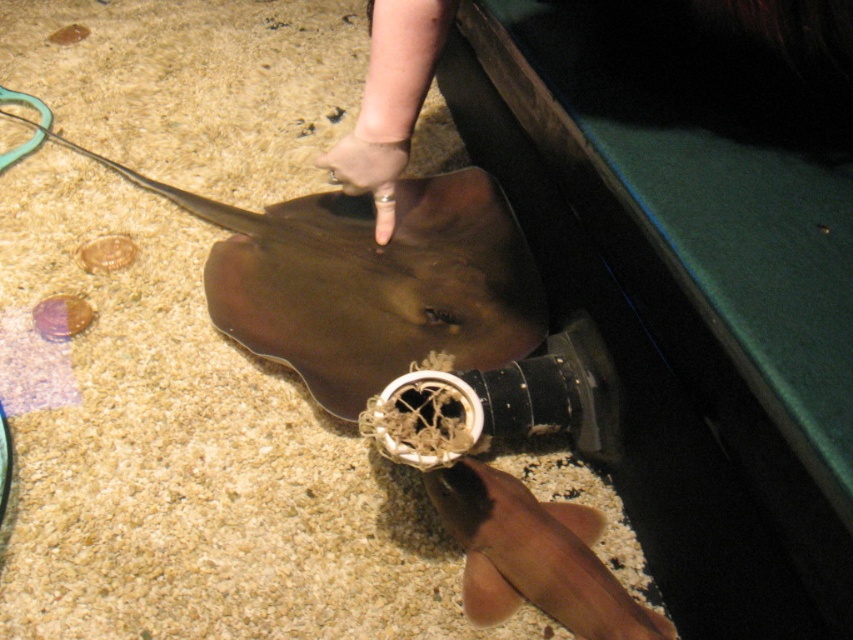
Question: Is brown matte stingray at center wider than smooth brown shark at lower center?

Choices:
 (A) yes
 (B) no

Answer: (A)

Question: Which object is closer to the camera taking this photo?

Choices:
 (A) smooth brown shark at lower center
 (B) brown matte stingray at center

Answer: (A)

Question: Among these points, which one is nearest to the camera?

Choices:
 (A) (469, 330)
 (B) (572, 561)

Answer: (B)

Question: Among these objects, which one is farthest from the camera?

Choices:
 (A) smooth brown shark at lower center
 (B) brown matte stingray at center

Answer: (B)

Question: Can you confirm if brown matte stingray at center is positioned to the right of smooth brown shark at lower center?

Choices:
 (A) no
 (B) yes

Answer: (A)

Question: Can you confirm if brown matte stingray at center is positioned above smooth brown shark at lower center?

Choices:
 (A) no
 (B) yes

Answer: (B)